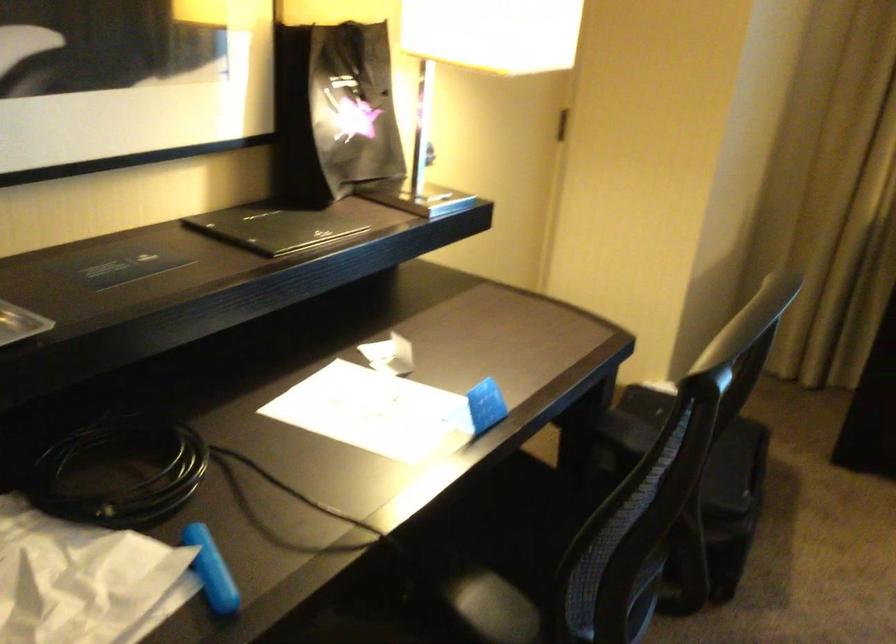
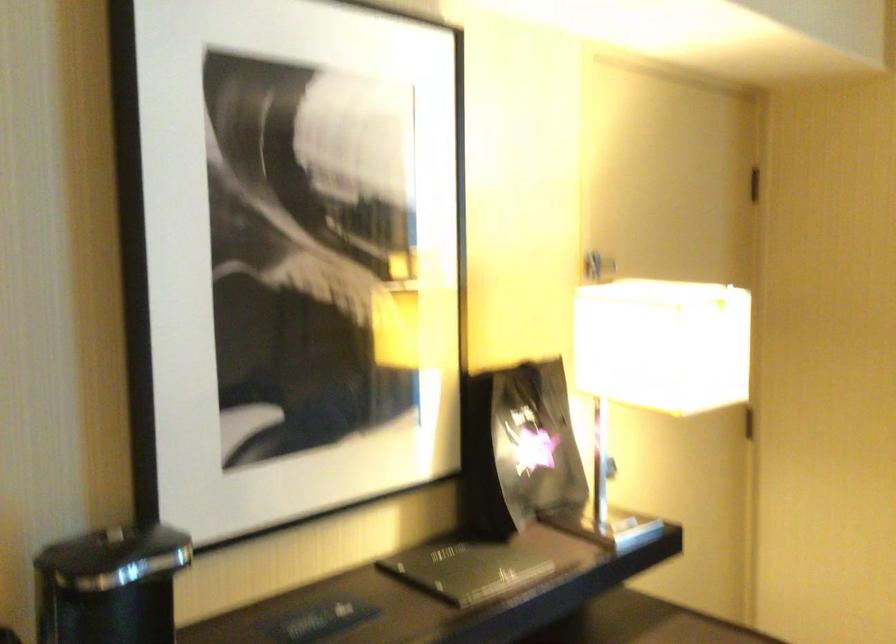
What movement of the cameraman would produce the second image?

The cameraman walked toward right, backward.